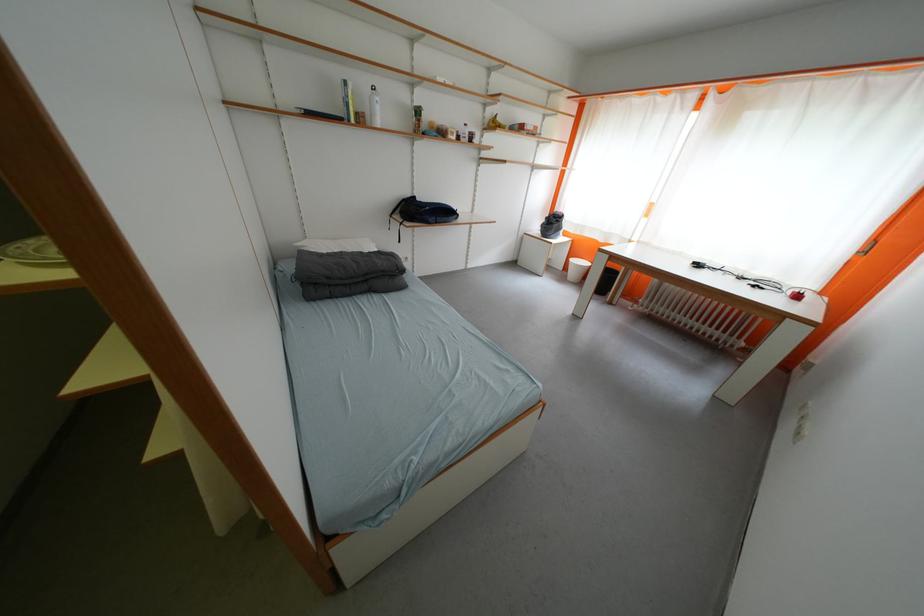
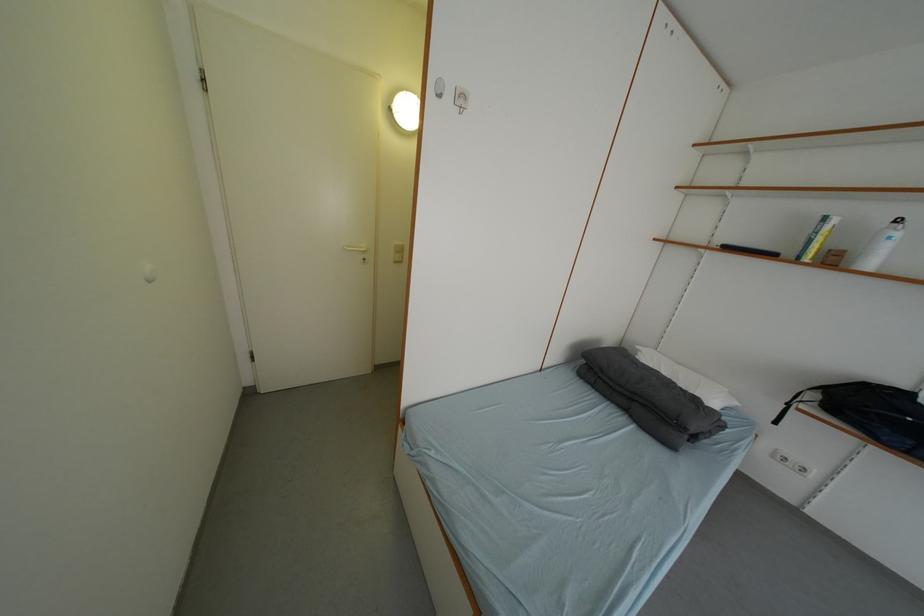
Question: The first image is from the beginning of the video and the second image is from the end. How did the camera likely rotate when shooting the video?

Choices:
 (A) Left
 (B) Right
 (C) Up
 (D) Down

Answer: (A)